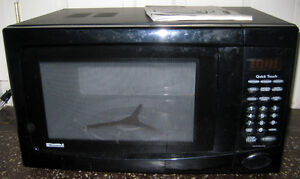
You are a GUI agent. You are given a task and a screenshot of the screen. Output one action in this format:
    pyautogui.click(x=<x>, y=<y>)
    Task: Click on the plug
    The image size is (300, 179).
    Given the screenshot: What is the action you would take?
    pyautogui.click(x=3, y=100)